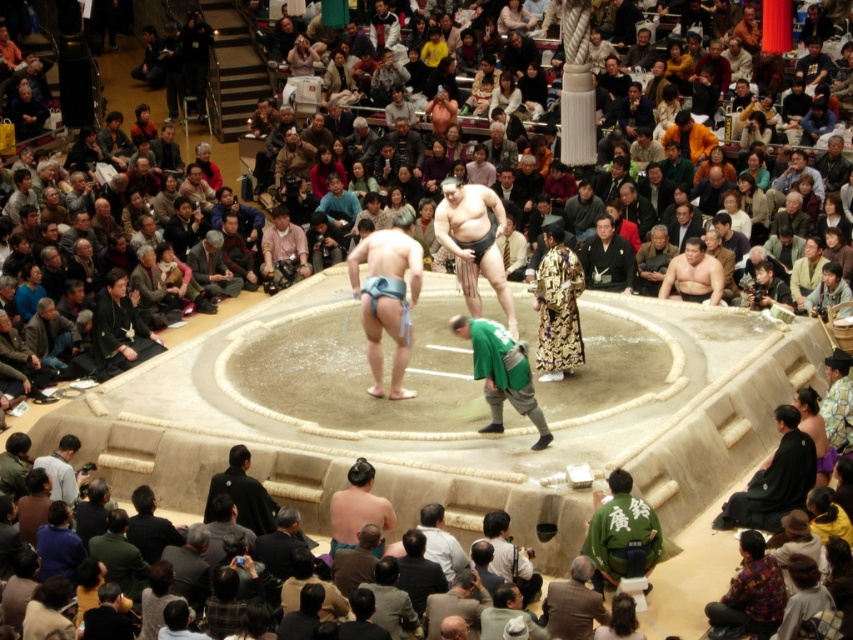
Consider the image. Which of these two, dark brown leather jacket at lower center or dark green fabric kimono at lower left, stands shorter?

With less height is dark brown leather jacket at lower center.

Does dark brown leather jacket at lower center have a greater height compared to dark green fabric kimono at lower left?

No.

Is point (590, 632) positioned behind point (73, 483)?

No, it is in front of (73, 483).

At what (x,y) coordinates should I click in order to perform the action: click on dark brown leather jacket at lower center. Please return your answer as a coordinate pair (x, y). Looking at the image, I should click on (573, 604).

Can you confirm if dark brown leather jacket at lower center is smaller than silk kimono at center?

Correct, dark brown leather jacket at lower center occupies less space than silk kimono at center.

Is dark brown leather jacket at lower center wider than silk kimono at center?

No, dark brown leather jacket at lower center is not wider than silk kimono at center.

Does point (582, 573) come behind point (596, 280)?

That is False.

Where is `dark brown leather jacket at lower center`? The height and width of the screenshot is (640, 853). dark brown leather jacket at lower center is located at coordinates (573, 604).

Does black silk kimono at lower right come in front of matte blue sumo at center?

Yes, it is in front of matte blue sumo at center.

Which of these two, black silk kimono at lower right or matte blue sumo at center, stands shorter?

With less height is matte blue sumo at center.

Which is behind, point (779, 492) or point (698, 291)?

The point (698, 291) is behind.

I want to click on black silk kimono at lower right, so click(x=775, y=480).